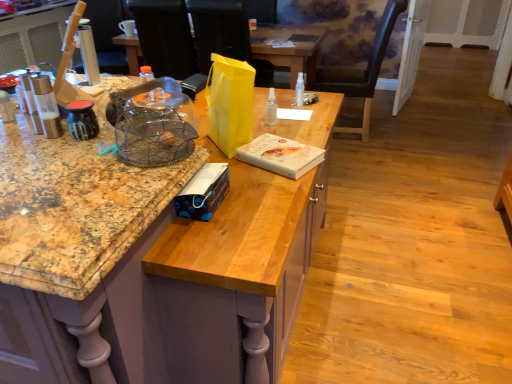
The image size is (512, 384). Identify the location of unoccupied area in front of matte black kettle at left, the 1th kitchen appliance when ordered from right to left. (65, 158).